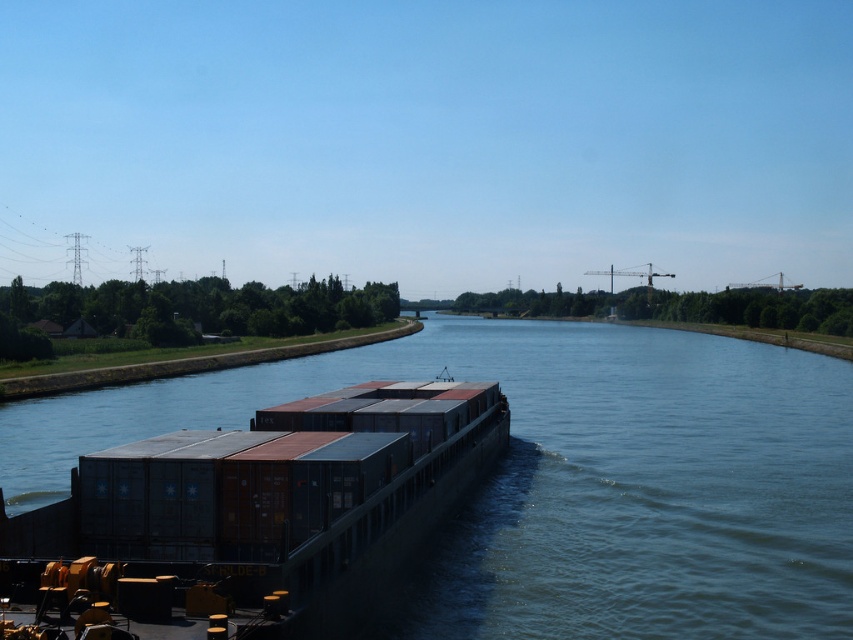
Question: Which object is closer to the camera taking this photo?

Choices:
 (A) blue water at center
 (B) metallic gray containers at center

Answer: (B)

Question: Among these points, which one is farthest from the camera?

Choices:
 (A) tap(457, 419)
 (B) tap(412, 608)

Answer: (A)

Question: Which object is closer to the camera taking this photo?

Choices:
 (A) blue water at center
 (B) metallic gray containers at center

Answer: (B)

Question: Does blue water at center lie behind metallic gray containers at center?

Choices:
 (A) yes
 (B) no

Answer: (A)

Question: Can you confirm if blue water at center is positioned to the left of metallic gray containers at center?

Choices:
 (A) yes
 (B) no

Answer: (B)

Question: Can you confirm if blue water at center is positioned above metallic gray containers at center?

Choices:
 (A) no
 (B) yes

Answer: (B)